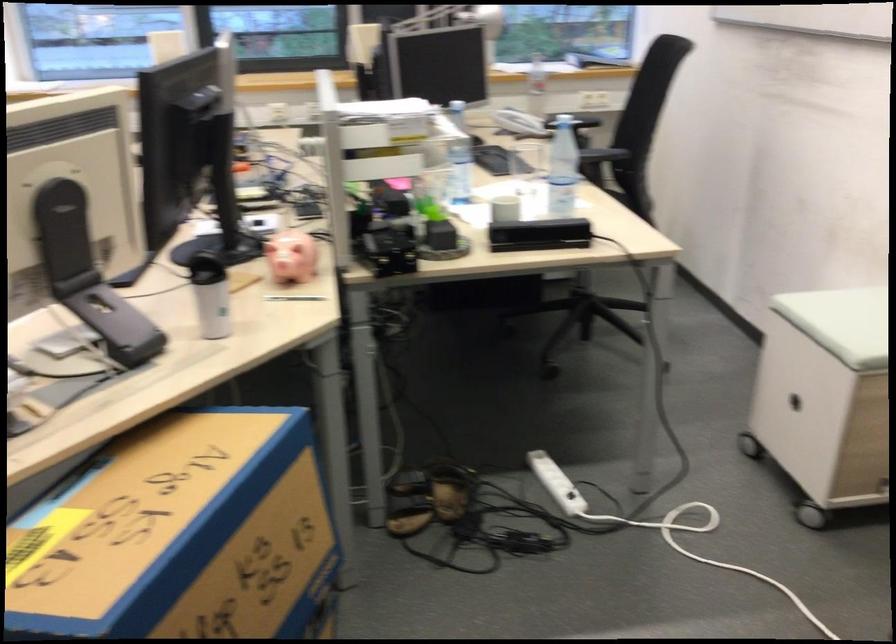
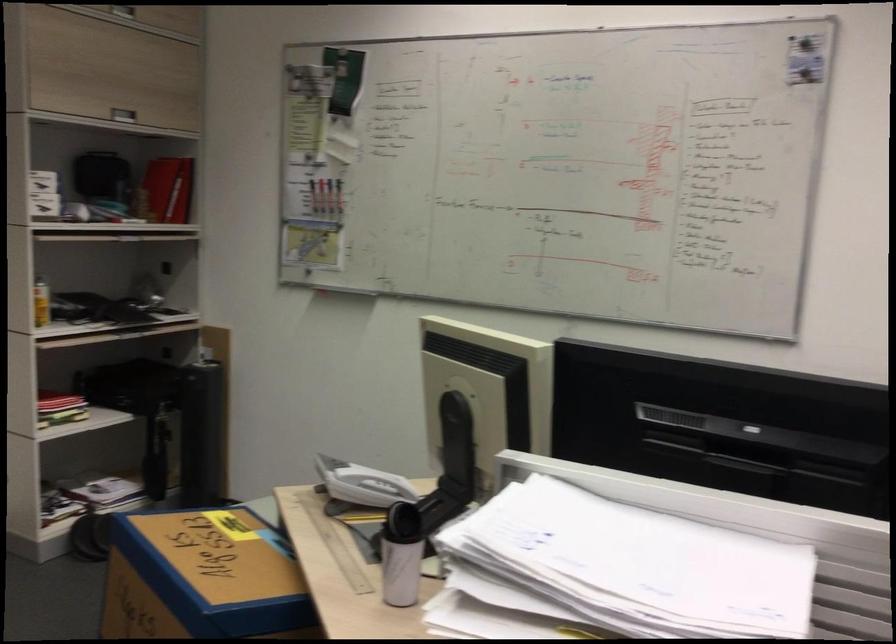
Find the pixel in the second image that matches (x=214, y=307) in the first image.

(400, 570)